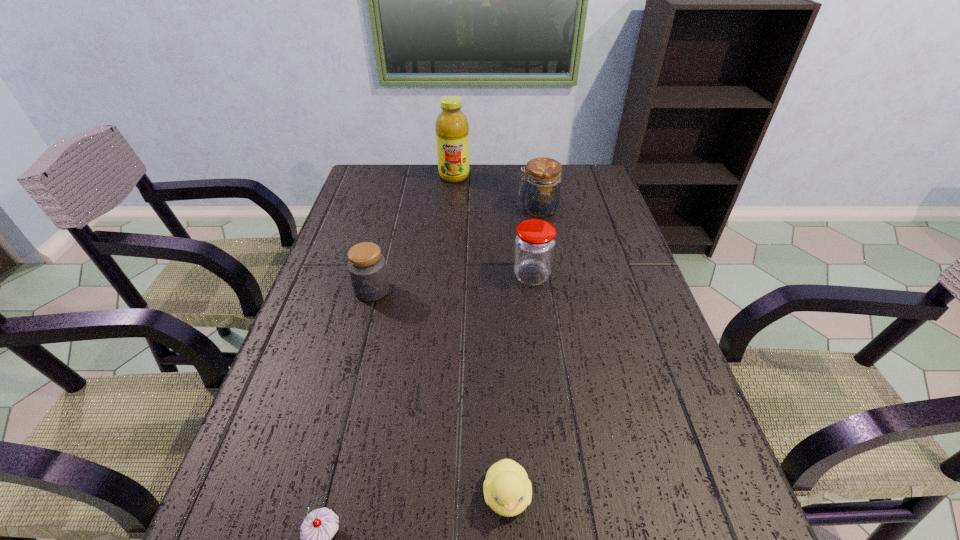
The width and height of the screenshot is (960, 540). Find the location of `fruit juice`. fruit juice is located at coordinates (452, 128).

What are the coordinates of `the farthest object` in the screenshot? It's located at (452, 128).

The image size is (960, 540). Find the location of `the second farthest object`. the second farthest object is located at coordinates (541, 193).

You are a GUI agent. You are given a task and a screenshot of the screen. Output one action in this format:
    pyautogui.click(x=<x>, y=<y>)
    Task: Click on the shortest jar
    This screenshot has width=960, height=540.
    Given the screenshot: What is the action you would take?
    pyautogui.click(x=367, y=269)

You are a GUI agent. You are given a task and a screenshot of the screen. Output one action in this format:
    pyautogui.click(x=<x>, y=<y>)
    Task: Click on the leftmost jar
    Image resolution: width=960 pixels, height=540 pixels.
    Given the screenshot: What is the action you would take?
    pyautogui.click(x=367, y=269)

In order to click on duckling in this screenshot , I will do `click(507, 490)`.

Identify the location of vacant position located on the front label of the tallest object. coord(450,222).

In order to click on free space located 0.170m on the lid of the farthest jar in this screenshot , I will do click(x=465, y=209).

The width and height of the screenshot is (960, 540). I want to click on vacant space located 0.080m on the lid of the farthest jar, so click(x=492, y=209).

Identify the location of vacant space located 0.150m on the lid of the farthest jar. (471, 209).